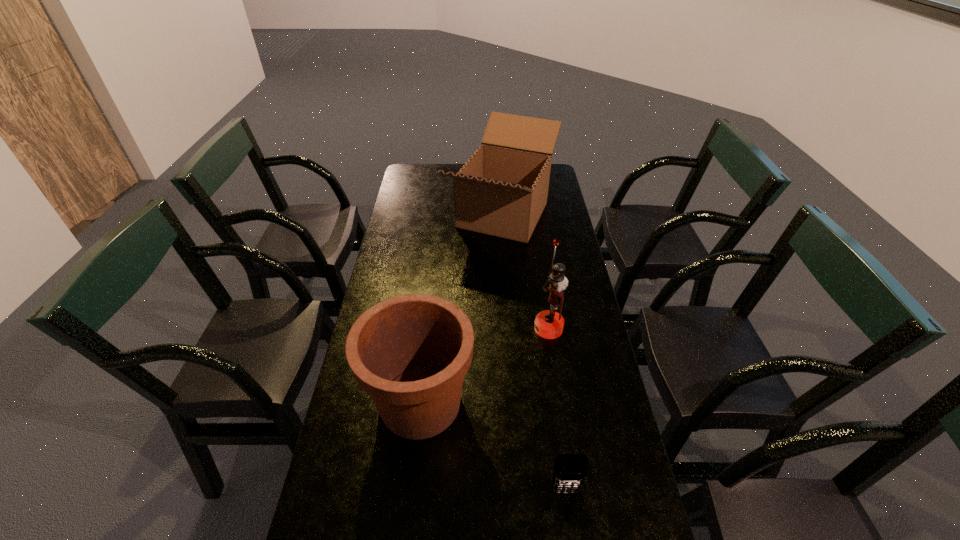
Find the location of a particular element. This screenshot has height=540, width=960. free spot between the box and the third nearest object is located at coordinates (526, 272).

The height and width of the screenshot is (540, 960). What are the coordinates of `the closest object to the shortest object` in the screenshot? It's located at (410, 353).

Find the location of a particular element. Image resolution: width=960 pixels, height=540 pixels. the closest object relative to the third farthest object is located at coordinates 570,470.

Find the location of `free point that satisfies the following two spatial constraints: 1. on the front-facing side of the nutcracker; 2. on the screen of the cellular telephone`. free point that satisfies the following two spatial constraints: 1. on the front-facing side of the nutcracker; 2. on the screen of the cellular telephone is located at coordinates (573, 491).

This screenshot has height=540, width=960. I want to click on vacant space that satisfies the following two spatial constraints: 1. on the front-facing side of the nutcracker; 2. on the screen of the cellular telephone, so click(x=573, y=491).

Find the location of a particular element. This screenshot has height=540, width=960. vacant region that satisfies the following two spatial constraints: 1. on the front-facing side of the nutcracker; 2. on the screen of the shortest object is located at coordinates (573, 491).